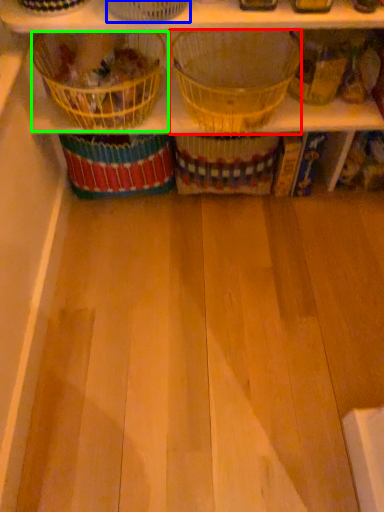
Question: Which object is the farthest from basket (highlighted by a red box)? Choose among these: basket (highlighted by a blue box) or basket (highlighted by a green box).

Choices:
 (A) basket
 (B) basket

Answer: (A)